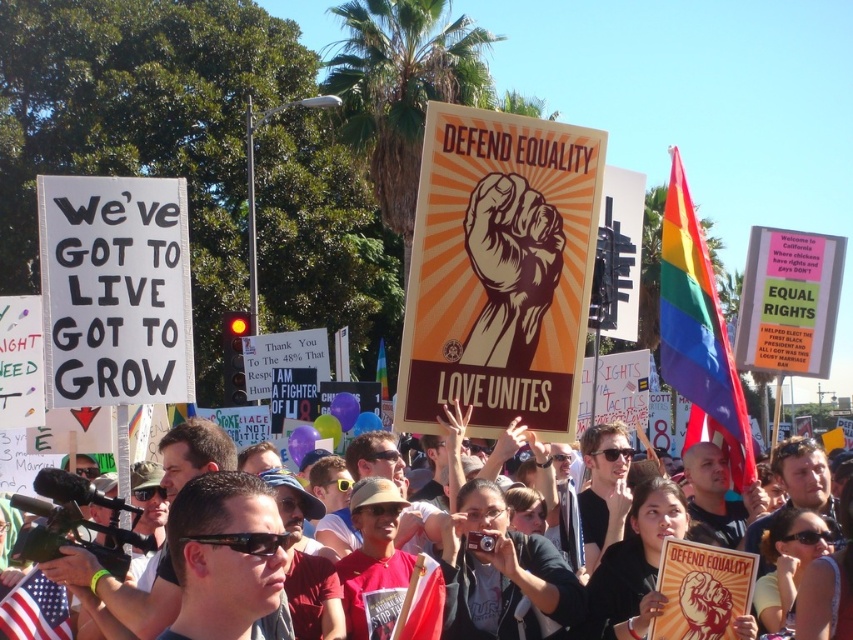
Between matte black sign at center and brown paper fist at center, which one has less height?

With less height is brown paper fist at center.

Is matte black sign at center in front of brown paper fist at center?

Yes.

The image size is (853, 640). In order to click on matte black sign at center in this screenshot , I will do `click(177, 467)`.

Does matte black sign at center appear on the right side of rainbow fabric flag at center?

Indeed, matte black sign at center is positioned on the right side of rainbow fabric flag at center.

Can you confirm if matte black sign at center is wider than rainbow fabric flag at center?

Yes, matte black sign at center is wider than rainbow fabric flag at center.

The width and height of the screenshot is (853, 640). Describe the element at coordinates (177, 467) in the screenshot. I see `matte black sign at center` at that location.

Where is `matte black sign at center`? This screenshot has width=853, height=640. matte black sign at center is located at coordinates (177, 467).

Can you confirm if brown paper fist at center is positioned above rainbow fabric flag at center?

Yes.

Looking at this image, can you confirm if brown paper fist at center is positioned to the right of rainbow fabric flag at center?

Correct, you'll find brown paper fist at center to the right of rainbow fabric flag at center.

The image size is (853, 640). I want to click on brown paper fist at center, so click(509, 268).

Image resolution: width=853 pixels, height=640 pixels. What are the coordinates of `brown paper fist at center` in the screenshot? It's located at click(x=509, y=268).